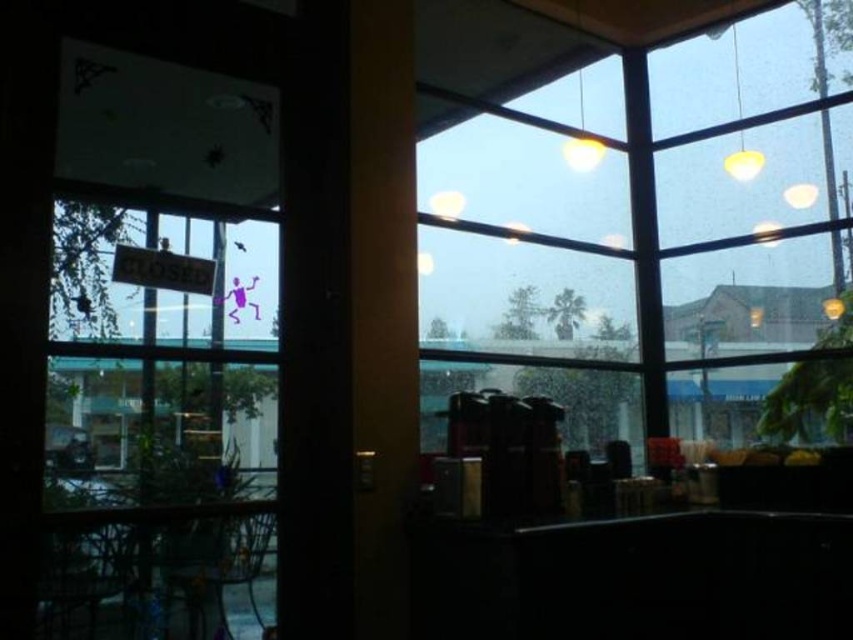
Question: Is transparent glass window at upper right above transparent glass door at left?

Choices:
 (A) yes
 (B) no

Answer: (A)

Question: Can you confirm if transparent glass door at left is positioned below yellow matte lamp at upper right?

Choices:
 (A) yes
 (B) no

Answer: (A)

Question: Is transparent glass window at upper right further to camera compared to yellow matte lamp at upper right?

Choices:
 (A) yes
 (B) no

Answer: (B)

Question: Which point is closer to the camera?

Choices:
 (A) transparent glass door at left
 (B) yellow matte lamp at upper right

Answer: (A)

Question: Based on their relative distances, which object is farther from the yellow matte lamp at upper right?

Choices:
 (A) transparent glass door at left
 (B) transparent glass window at upper right

Answer: (A)

Question: Based on their relative distances, which object is nearer to the yellow matte lamp at upper right?

Choices:
 (A) transparent glass door at left
 (B) transparent glass window at upper right

Answer: (B)